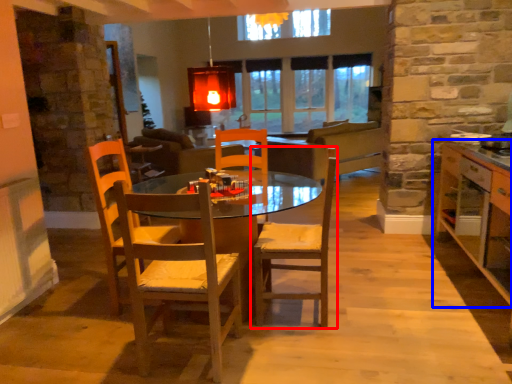
Question: Which of the following is the closest to the observer, chair (highlighted by a red box) or cabinetry (highlighted by a blue box)?

Choices:
 (A) chair
 (B) cabinetry

Answer: (B)